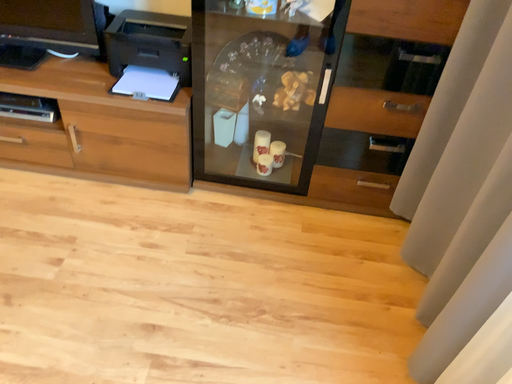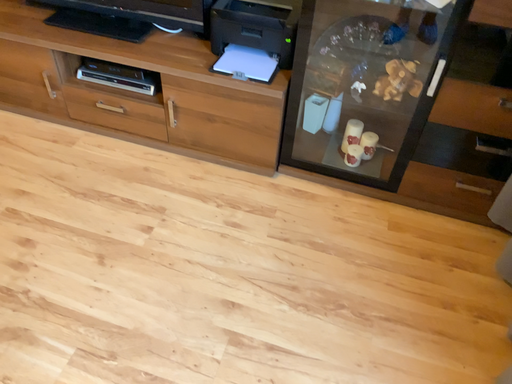
Question: Which way did the camera rotate in the video?

Choices:
 (A) rotated left
 (B) rotated right

Answer: (A)